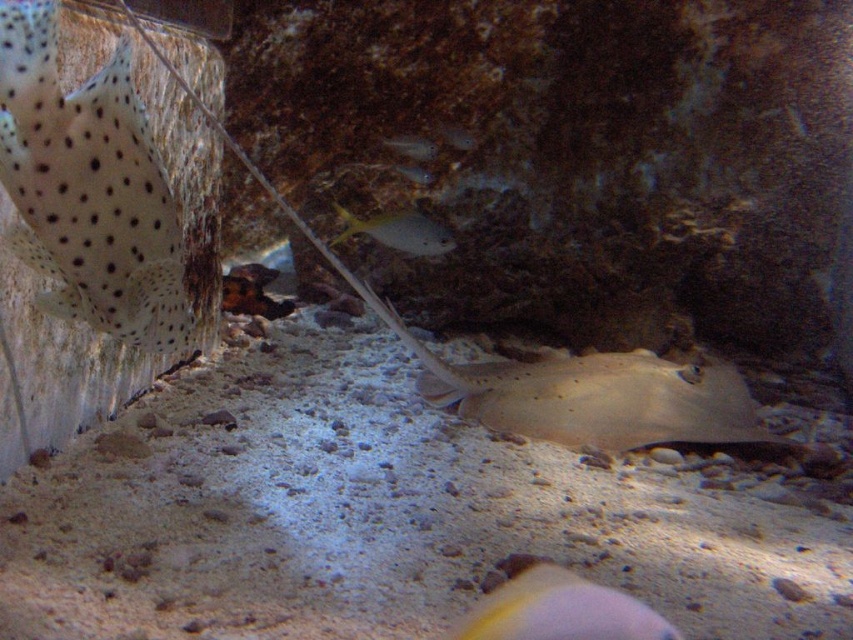
You are a marine biologist observing the underwater scene. You notice the spotted white at left and the translucent yellow fish at center. Which of these two fish is taller?

The spotted white at left is taller than the translucent yellow fish at center.

You are a marine biologist observing this underwater scene. You notice the spotted white at left and the translucent yellow fish at center. Which of these two fish is bigger?

The spotted white at left is larger in size compared to the translucent yellow fish at center.

You are a marine biologist observing the underwater scene. You notice two marine creatures, the spotted white at left and the light beige smooth stingray at center. Which creature has a thinner body?

The spotted white at left has a thinner body than the light beige smooth stingray at center.